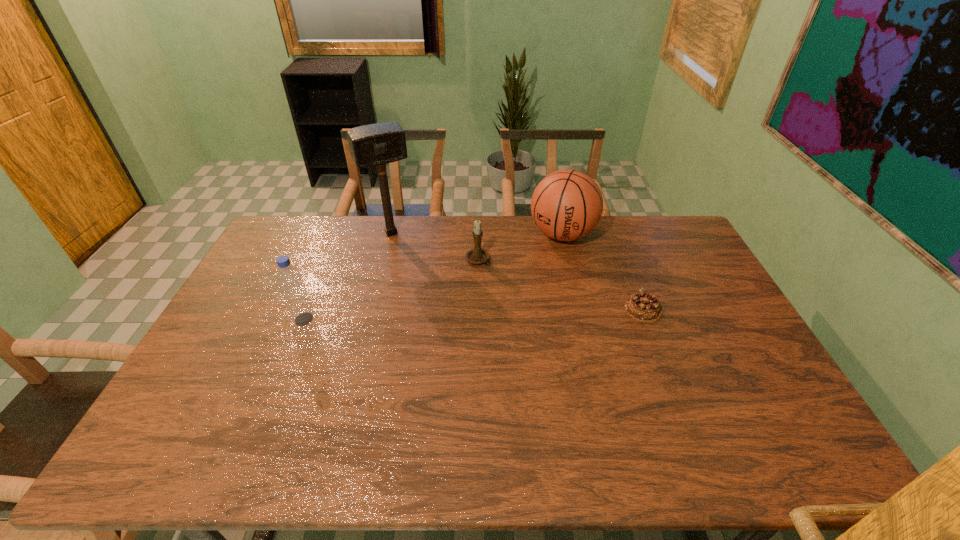
Identify the location of vacant space located on the head of the fourth object from right to left. (422, 288).

Locate an element on the screen. This screenshot has width=960, height=540. blank space located 0.150m on the head of the fourth object from right to left is located at coordinates (411, 267).

Locate an element on the screen. This screenshot has height=540, width=960. free region located on the head of the fourth object from right to left is located at coordinates tap(415, 274).

Identify the location of free space located 0.220m on the side of the candle holder with the handle. The height and width of the screenshot is (540, 960). (500, 313).

Find the location of `blank space located on the side of the candle holder with the handle`. blank space located on the side of the candle holder with the handle is located at coordinates (492, 294).

This screenshot has height=540, width=960. In order to click on free space located on the side of the candle holder with the handle in this screenshot , I will do `click(518, 352)`.

Where is `vacant space located 0.260m on the surface of the fourth object from left to right near the brand logo`? The image size is (960, 540). vacant space located 0.260m on the surface of the fourth object from left to right near the brand logo is located at coordinates (526, 299).

Identify the location of vacant region located 0.320m on the surface of the fourth object from left to right near the brand logo. (519, 310).

Locate an element on the screen. The height and width of the screenshot is (540, 960). vacant area situated 0.250m on the surface of the fourth object from left to right near the brand logo is located at coordinates (527, 296).

Find the location of `mallet at the far edge`. mallet at the far edge is located at coordinates (377, 144).